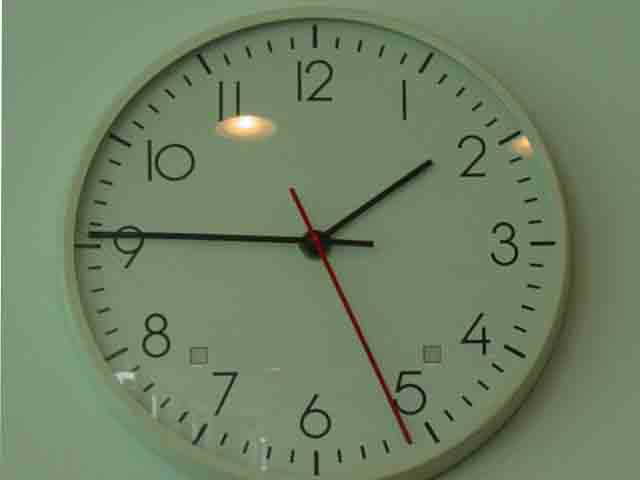
Identify the location of clock minute markers. (292, 48), (269, 47), (246, 51), (226, 60).